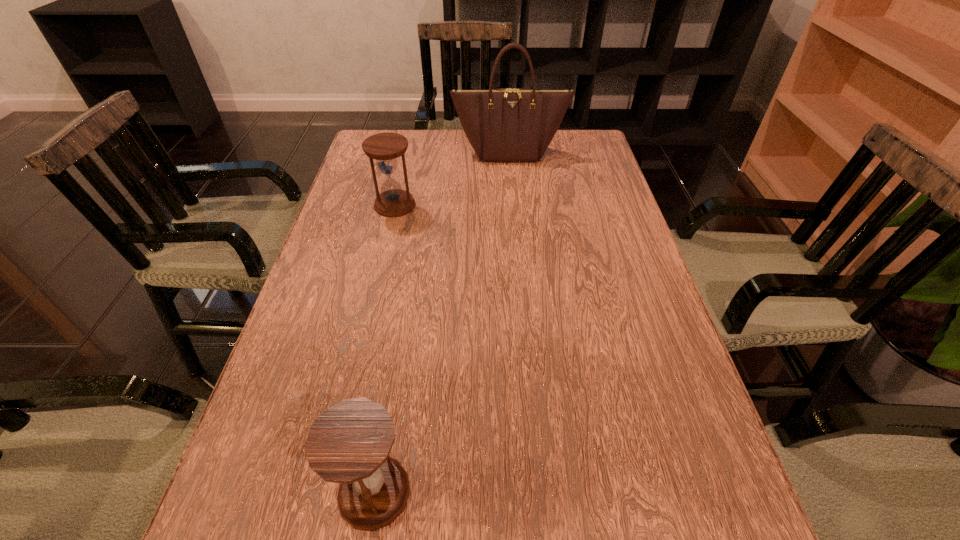
Where is `blank region between the nearer hourglass and the farthest object`? This screenshot has width=960, height=540. blank region between the nearer hourglass and the farthest object is located at coordinates (442, 322).

At what (x,y) coordinates should I click in order to perform the action: click on free spot between the farther hourglass and the nearer hourglass. Please return your answer as a coordinate pair (x, y). The width and height of the screenshot is (960, 540). Looking at the image, I should click on (385, 348).

Where is `free space between the nearest object and the second nearest object`? This screenshot has width=960, height=540. free space between the nearest object and the second nearest object is located at coordinates (385, 348).

Select which object is the second closest to the nearest object. Please provide its 2D coordinates. Your answer should be formatted as a tuple, i.e. [(x, y)], where the tuple contains the x and y coordinates of a point satisfying the conditions above.

[(508, 124)]

What are the coordinates of `object that is the closest to the second farthest object` in the screenshot? It's located at (508, 124).

You are a GUI agent. You are given a task and a screenshot of the screen. Output one action in this format:
    pyautogui.click(x=<x>, y=<y>)
    Task: Click on the free spot that satisfies the following two spatial constraints: 1. on the front side of the nearest object; 2. on the right side of the second farthest object
    Image resolution: width=960 pixels, height=540 pixels.
    Given the screenshot: What is the action you would take?
    pyautogui.click(x=328, y=492)